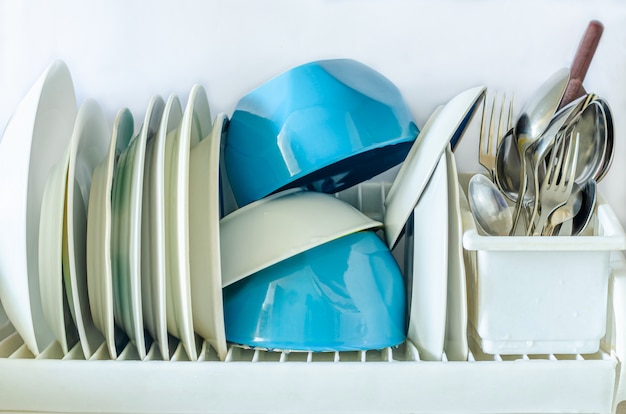
Where is `utensils`? utensils is located at coordinates (488, 196), (493, 126), (506, 165), (528, 115), (546, 144), (550, 193), (583, 213), (583, 141), (618, 135), (585, 57).